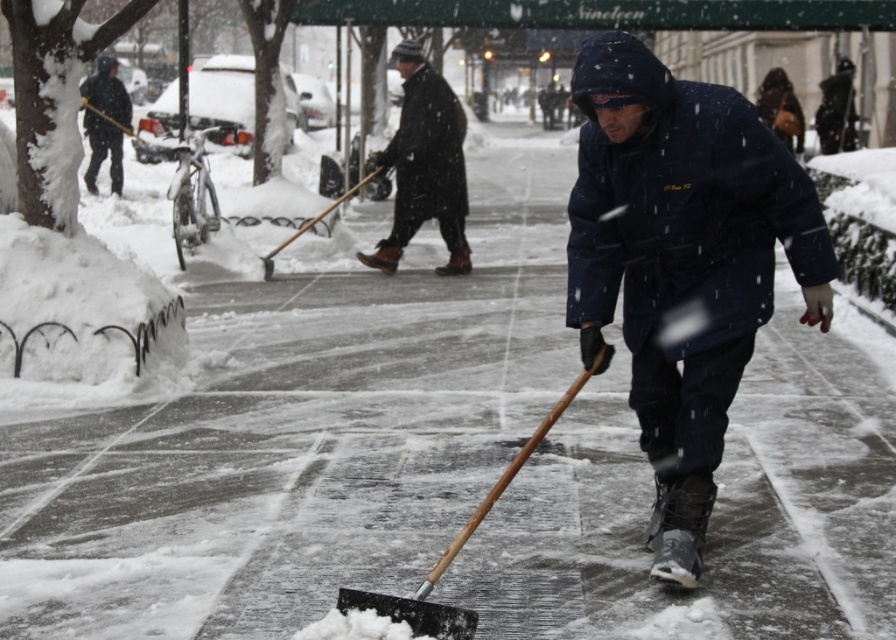
Is dark woolen coat at center above dark blue jacket at upper left?

Incorrect, dark woolen coat at center is not positioned above dark blue jacket at upper left.

Identify the location of dark woolen coat at center. The height and width of the screenshot is (640, 896). (425, 164).

Is point (419, 218) closer to viewer compared to point (125, 113)?

Yes, point (419, 218) is in front of point (125, 113).

At what (x,y) coordinates should I click in order to perform the action: click on dark woolen coat at center. Please return your answer as a coordinate pair (x, y). This screenshot has width=896, height=640. Looking at the image, I should click on (425, 164).

Can you confirm if dark woolen coat at center is wider than black plastic shovel at center?

Yes.

Does dark woolen coat at center have a lesser width compared to black plastic shovel at center?

In fact, dark woolen coat at center might be wider than black plastic shovel at center.

Between point (445, 115) and point (415, 621), which one is positioned in front?

Point (415, 621)

Image resolution: width=896 pixels, height=640 pixels. I want to click on dark woolen coat at center, so click(425, 164).

Does point (389, 164) come in front of point (266, 262)?

Yes, point (389, 164) is in front of point (266, 262).

Is dark woolen coat at center smaller than wooden shovel at center?

No, dark woolen coat at center is not smaller than wooden shovel at center.

Identify the location of dark woolen coat at center. (425, 164).